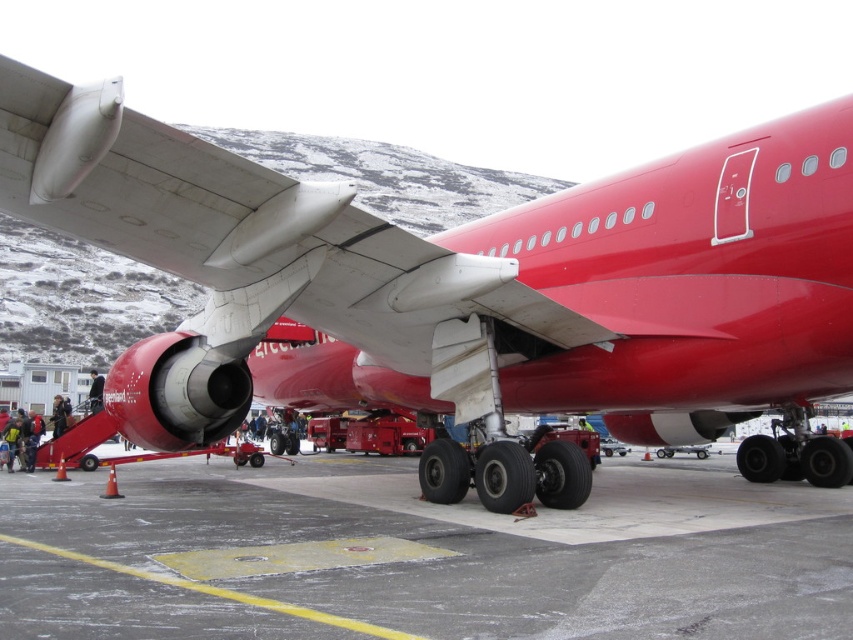
You are a maintenance worker at the airport. You need to determine if the matte red airplane at center can fit through a narrow gate that is as wide as the gray asphalt at lower center. Can it pass through?

The matte red airplane at center is thinner than the gray asphalt at lower center, so it can pass through the gate.